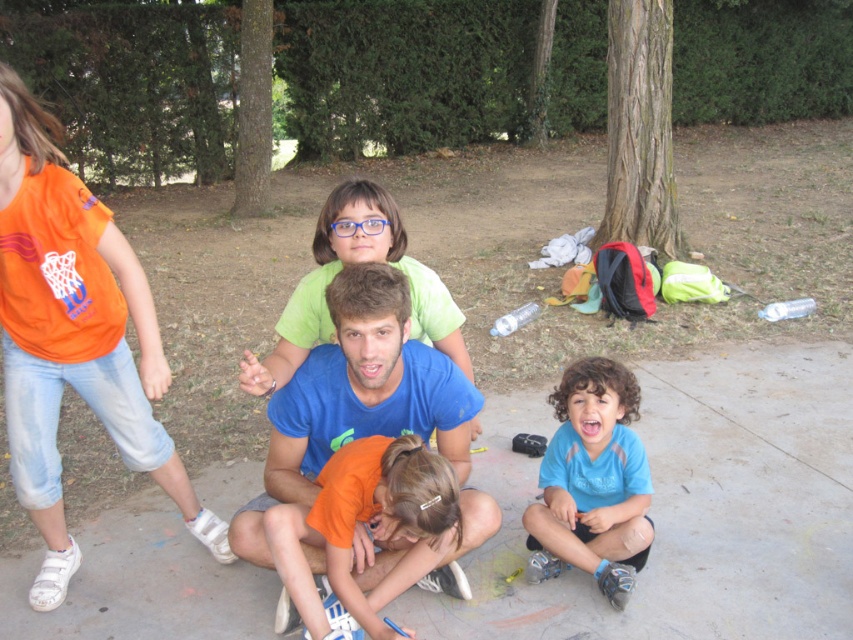
Which is above, concrete at center or green matte shirt at center?

green matte shirt at center is higher up.

Can you confirm if concrete at center is wider than green matte shirt at center?

Indeed, concrete at center has a greater width compared to green matte shirt at center.

Is point (849, 554) farther from camera compared to point (283, 348)?

That is True.

I want to click on concrete at center, so (689, 508).

Is orange cotton shirt at left smaller than orange cotton shirt at lower center?

No.

Does orange cotton shirt at left have a lesser width compared to orange cotton shirt at lower center?

In fact, orange cotton shirt at left might be wider than orange cotton shirt at lower center.

Is point (51, 380) in front of point (268, 544)?

No, (51, 380) is behind (268, 544).

Image resolution: width=853 pixels, height=640 pixels. I want to click on orange cotton shirt at left, so click(x=73, y=337).

Between blue cotton shirt at center and blue matte shirt at lower right, which one is positioned higher?

blue cotton shirt at center is higher up.

Is point (427, 358) in front of point (583, 538)?

Yes.

Locate an element on the screen. blue cotton shirt at center is located at coordinates (357, 397).

The width and height of the screenshot is (853, 640). What are the coordinates of `blue cotton shirt at center` in the screenshot? It's located at (357, 397).